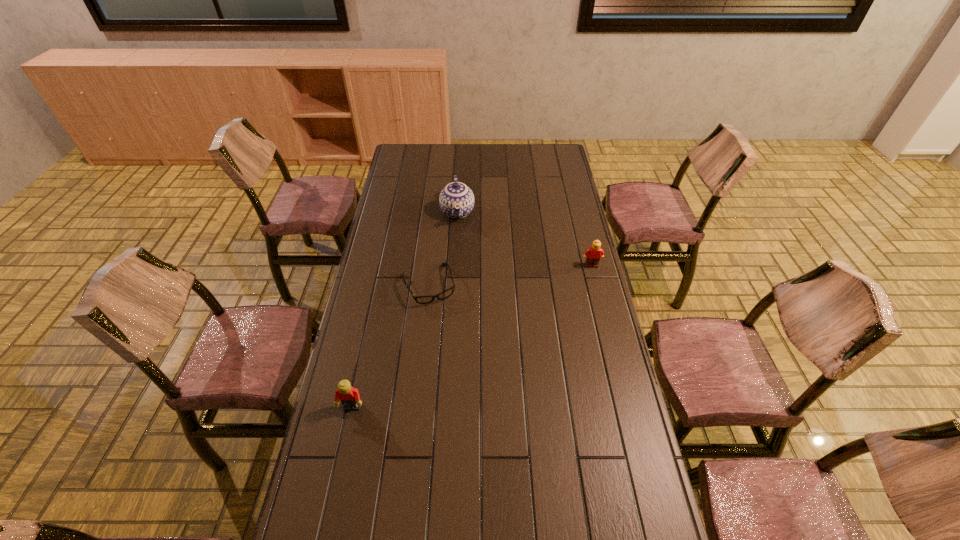
Locate an element on the screen. The width and height of the screenshot is (960, 540). empty location between the farther Lego and the farthest object is located at coordinates click(x=524, y=239).

Locate an element on the screen. free space between the right Lego and the tallest object is located at coordinates (524, 239).

Select which object appears as the second closest to the shortest object. Please provide its 2D coordinates. Your answer should be formatted as a tuple, i.e. [(x, y)], where the tuple contains the x and y coordinates of a point satisfying the conditions above.

[(349, 396)]

Identify which object is the third closest to the chinaware. Please provide its 2D coordinates. Your answer should be formatted as a tuple, i.e. [(x, y)], where the tuple contains the x and y coordinates of a point satisfying the conditions above.

[(349, 396)]

Locate an element on the screen. The height and width of the screenshot is (540, 960). free space that satisfies the following two spatial constraints: 1. on the back side of the chinaware; 2. on the right side of the shortest object is located at coordinates (437, 212).